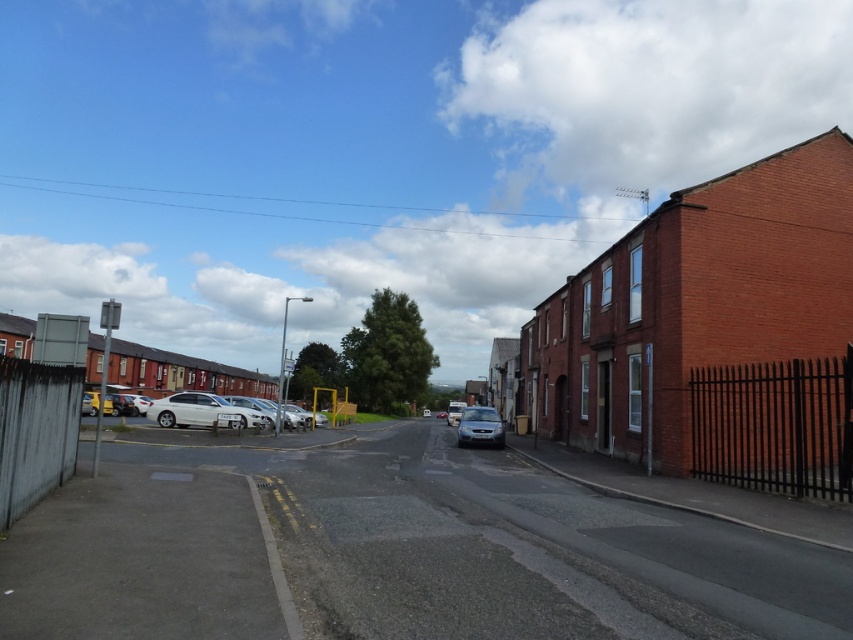
You are a delivery driver needing to park your vehicle between the white matte sedan at center and the satin silver car at center. Which side of the two cars should you park on to ensure your vehicle fits without overlapping either?

You should park to the left of the white matte sedan at center and the satin silver car at center since the white matte sedan at center is already positioned to the left of the satin silver car at center, leaving space on the left side for your vehicle without overlapping.

Consider the image. You are a delivery driver who needs to park your white matte sedan at center in a spot that is not blocked by other vehicles. Based on the scene, can you find an available parking spot near the point marked at coordinate (x=202, y=412)?

The white matte sedan at center is already located at the point marked at coordinate (x=202, y=412), so there is no available parking spot there. Please look for another location.